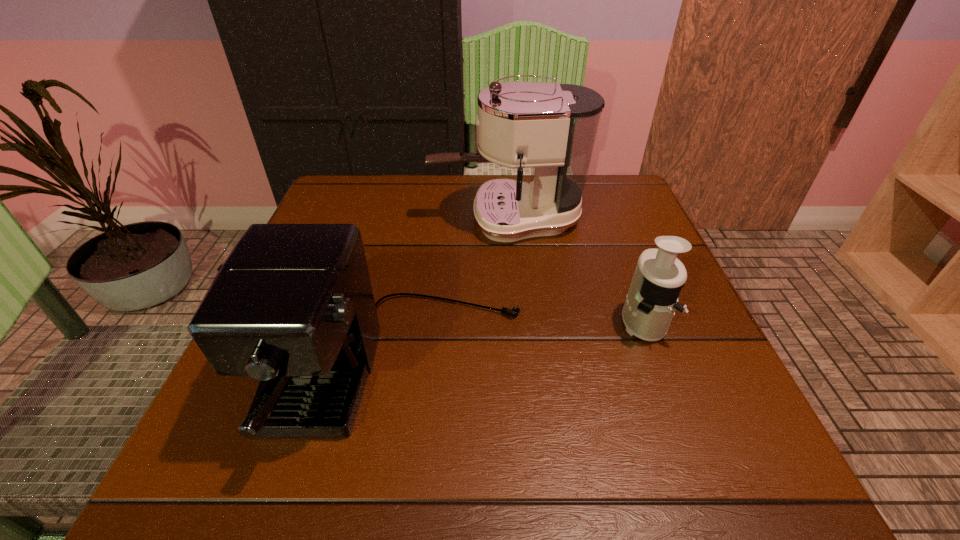
Find the location of `vacant space at the far left corner`. vacant space at the far left corner is located at coordinates (335, 199).

The image size is (960, 540). I want to click on free space at the near left corner of the desktop, so click(x=235, y=449).

In the image, there is a desktop. Where is `vacant space at the far right corner`? vacant space at the far right corner is located at coordinates (588, 199).

The width and height of the screenshot is (960, 540). Find the location of `empty space between the shortest object and the second tallest object`. empty space between the shortest object and the second tallest object is located at coordinates (520, 346).

I want to click on free spot between the nearer coffee maker and the rightmost object, so click(520, 346).

Where is `free space that is in between the farther coffee maker and the shortest object`? The width and height of the screenshot is (960, 540). free space that is in between the farther coffee maker and the shortest object is located at coordinates (575, 270).

At what (x,y) coordinates should I click in order to perform the action: click on free space that is in between the taller coffee maker and the second shortest object. Please return your answer as a coordinate pair (x, y). Looking at the image, I should click on (452, 295).

At what (x,y) coordinates should I click in order to perform the action: click on free space between the farther coffee maker and the second shortest object. Please return your answer as a coordinate pair (x, y). Looking at the image, I should click on (452, 295).

Find the location of a particular element. free space between the taller coffee maker and the second shortest object is located at coordinates (452, 295).

This screenshot has width=960, height=540. In order to click on vacant point located between the shortest object and the tallest object in this screenshot , I will do `click(575, 270)`.